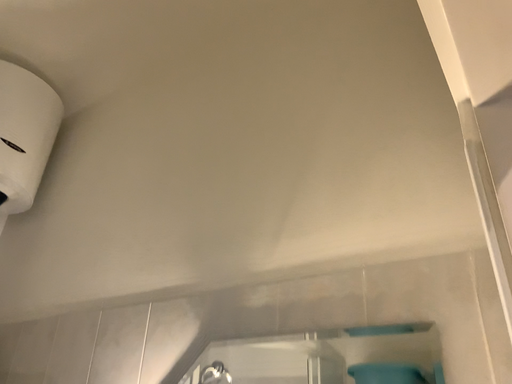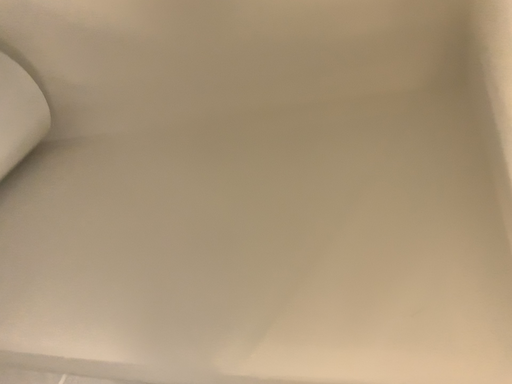
Question: Which way did the camera rotate in the video?

Choices:
 (A) rotated upward
 (B) rotated downward

Answer: (A)